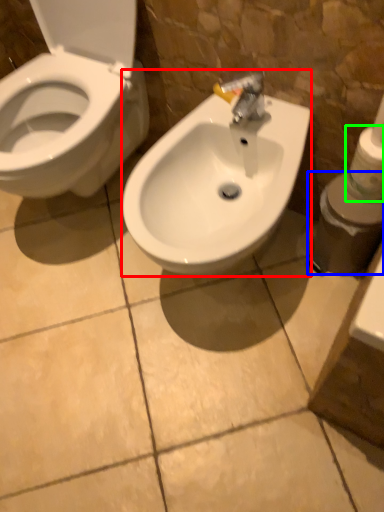
Question: Which is farther away from sink (highlighted by a red box)? toiletries (highlighted by a blue box) or toilet paper (highlighted by a green box)?

Choices:
 (A) toiletries
 (B) toilet paper

Answer: (B)